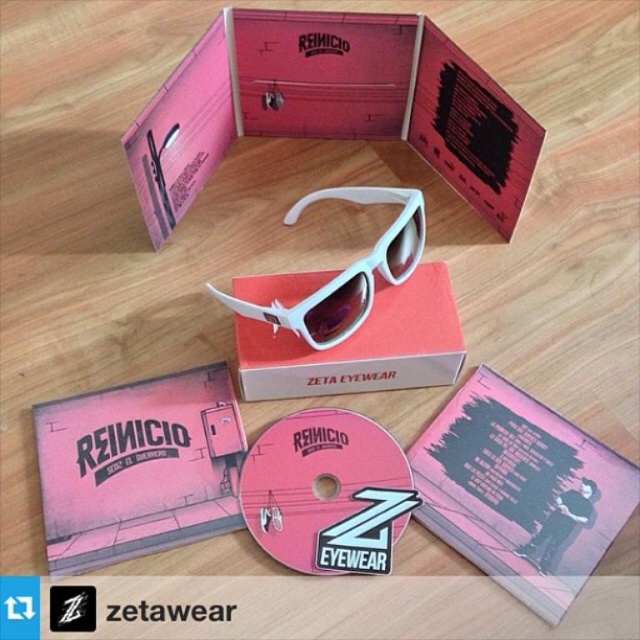
Question: Which object is the closest to the white matte sunglasses at center?

Choices:
 (A) pink matte cd at center
 (B) matte pink album at center
 (C) matte pink cardboard box at center

Answer: (A)

Question: Among these objects, which one is nearest to the camera?

Choices:
 (A) white matte sunglasses at center
 (B) pink matte album at center
 (C) matte pink album at center
 (D) matte pink cardboard box at center

Answer: (B)

Question: Among these points, which one is nearest to the camera?

Choices:
 (A) (404, 340)
 (B) (163, 412)
 (C) (515, 465)

Answer: (C)

Question: Does pink matte album at center have a greater width compared to white matte box at center?

Choices:
 (A) yes
 (B) no

Answer: (B)

Question: Does pink matte cd at center appear on the left side of white matte box at center?

Choices:
 (A) yes
 (B) no

Answer: (A)

Question: Can you confirm if matte pink cardboard box at center is bigger than white matte box at center?

Choices:
 (A) yes
 (B) no

Answer: (A)